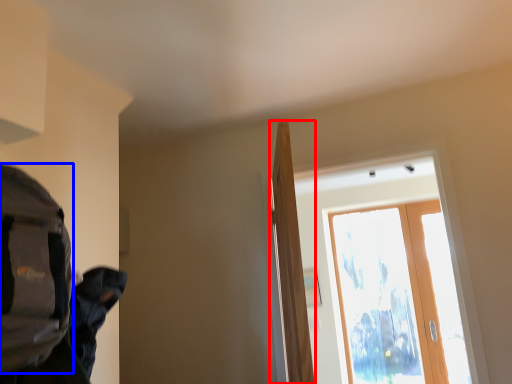
Question: Which object appears closest to the camera in this image, door (highlighted by a red box) or backpack (highlighted by a blue box)?

Choices:
 (A) door
 (B) backpack

Answer: (B)